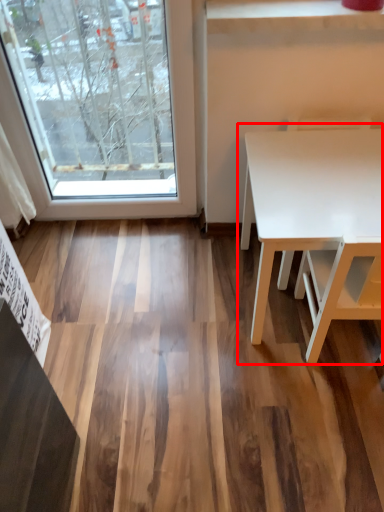
Question: From the image's perspective, considering the relative positions of table (annotated by the red box) and chair in the image provided, where is table (annotated by the red box) located with respect to the staircase?

Choices:
 (A) above
 (B) below

Answer: (B)